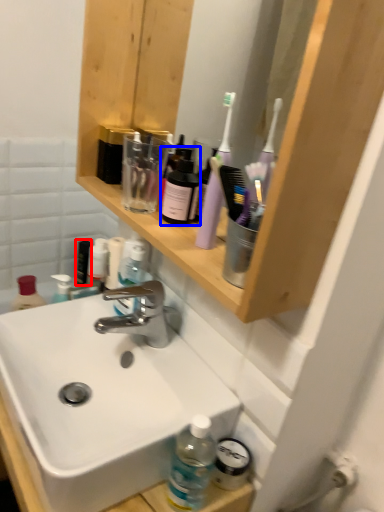
Question: Among these objects, which one is nearest to the camera, toiletry (highlighted by a red box) or mouthwash (highlighted by a blue box)?

Choices:
 (A) toiletry
 (B) mouthwash

Answer: (B)